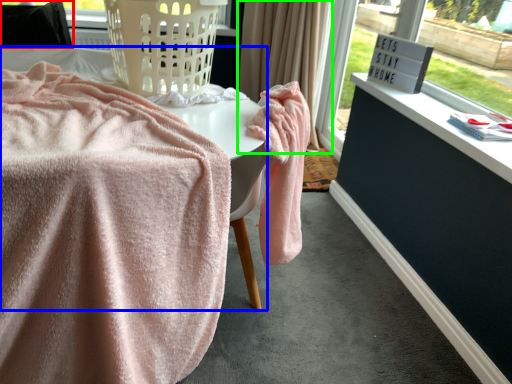
Question: Based on their relative distances, which object is nearer to furniture (highlighted by a red box)? Choose from table (highlighted by a blue box) and curtain (highlighted by a green box).

Choices:
 (A) table
 (B) curtain

Answer: (A)